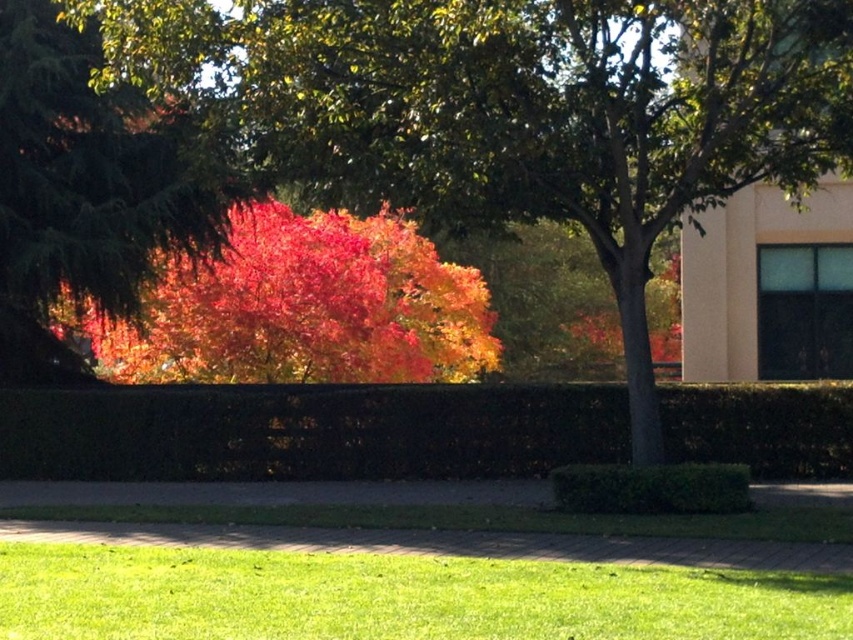
Consider the image. You are standing at the center of the image and want to walk towards the green grass at lower left. Which direction should you face to move directly towards it?

You should face towards the lower left direction to move directly towards the green grass at lower left since its 2D location is at point (395,596).

You are a gardener who wants to plant a new flower bed. You have two areas to choose from in the scene. One is the green grass at lower left and the other is the vivid red leaves at upper left. Which area has more space available for planting?

The green grass at lower left is thinner than the vivid red leaves at upper left, so the green grass at lower left has more space available for planting.